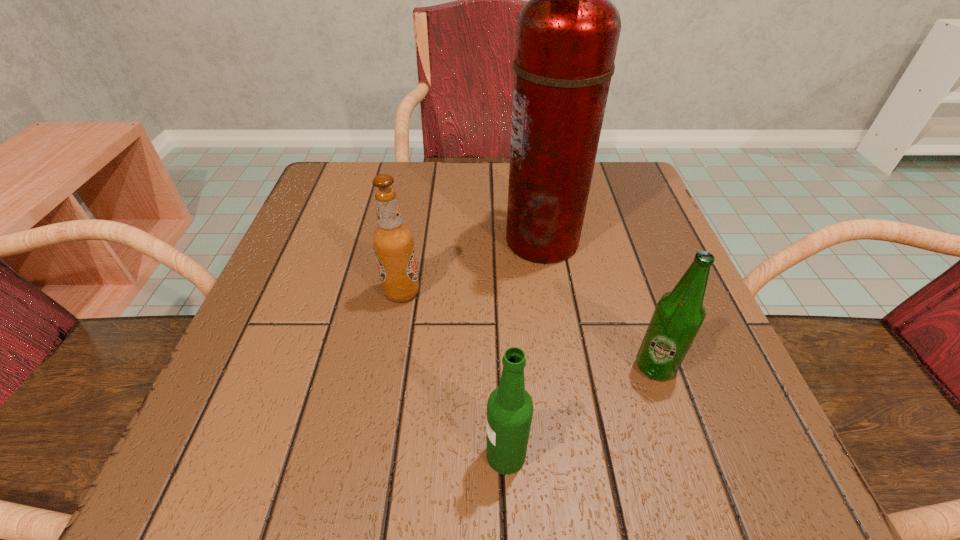
In the image, there is a desktop. Find the location of `vacant space at the near edge`. vacant space at the near edge is located at coordinates (560, 450).

Where is `free location at the left edge`? This screenshot has height=540, width=960. free location at the left edge is located at coordinates tap(216, 405).

Where is `vacant space at the right edge`? Image resolution: width=960 pixels, height=540 pixels. vacant space at the right edge is located at coordinates (645, 252).

I want to click on free space at the far left corner, so click(329, 190).

The image size is (960, 540). I want to click on free location at the near left corner, so click(x=250, y=485).

The image size is (960, 540). In the image, there is a desktop. In order to click on vacant space at the far right corner in this screenshot , I will do `click(623, 200)`.

Locate an element on the screen. The height and width of the screenshot is (540, 960). free space at the near right corner of the desktop is located at coordinates (741, 436).

Identify the location of free space that is in between the rightmost object and the fire extinguisher. Image resolution: width=960 pixels, height=540 pixels. (599, 303).

Where is `vacant area that lies between the farthest object and the second nearest beer bottle`? vacant area that lies between the farthest object and the second nearest beer bottle is located at coordinates point(599,303).

Where is `vacant point located between the second beer bottle from right to left and the third farthest object`? vacant point located between the second beer bottle from right to left and the third farthest object is located at coordinates (581, 411).